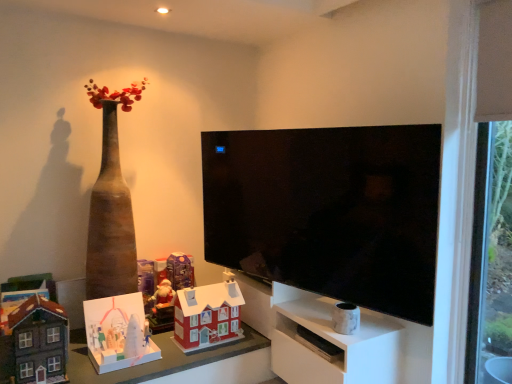
Identify the location of vacant area that is situated to the right of matte gray toy house at lower left, the fifth toy viewed from the right. (86, 373).